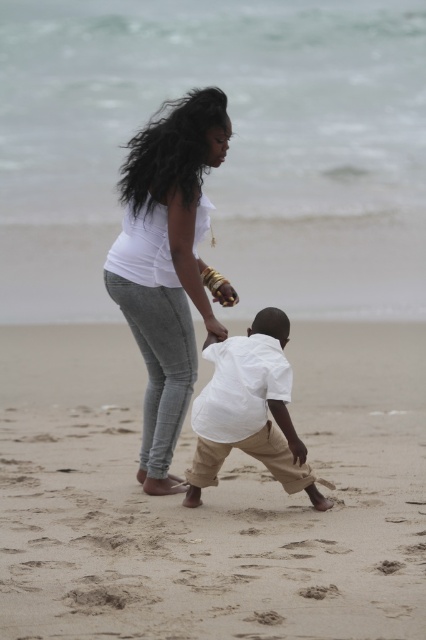
Question: Estimate the real-world distances between objects in this image. Which object is farther from the sandy beige sand at center?

Choices:
 (A) white cotton shirt at center
 (B) white matte shirt at center

Answer: (B)

Question: Does sandy beige sand at center appear over white cotton shirt at center?

Choices:
 (A) no
 (B) yes

Answer: (A)

Question: From the image, what is the correct spatial relationship of sandy beige sand at center in relation to white matte shirt at center?

Choices:
 (A) right
 (B) left

Answer: (B)

Question: Is sandy beige sand at center closer to the viewer compared to white cotton shirt at center?

Choices:
 (A) yes
 (B) no

Answer: (A)

Question: Which point is closer to the camera?

Choices:
 (A) sandy beige sand at center
 (B) white matte shirt at center
 (C) white cotton shirt at center

Answer: (A)

Question: Which point appears farthest from the camera in this image?

Choices:
 (A) (322, 509)
 (B) (147, 344)
 (C) (423, 412)

Answer: (C)